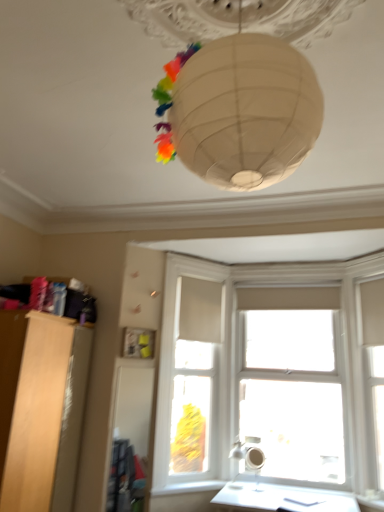
Where is `blank space situated above white wood window frame at center, arranged as the second window frame when viewed from the right (from a real-world perspective)`? blank space situated above white wood window frame at center, arranged as the second window frame when viewed from the right (from a real-world perspective) is located at coordinates (198, 260).